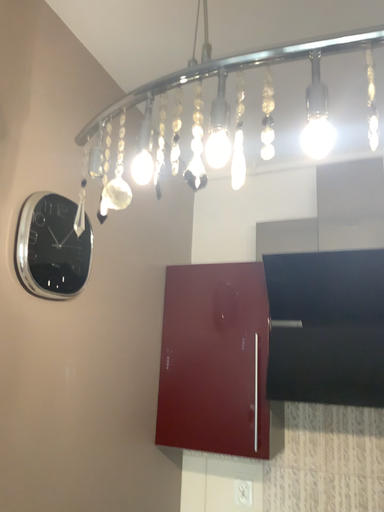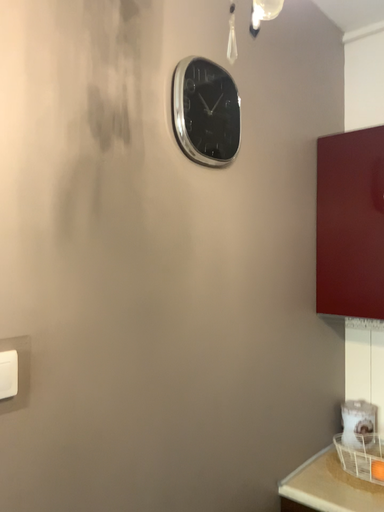
Question: Which way did the camera rotate in the video?

Choices:
 (A) rotated right
 (B) rotated left

Answer: (B)